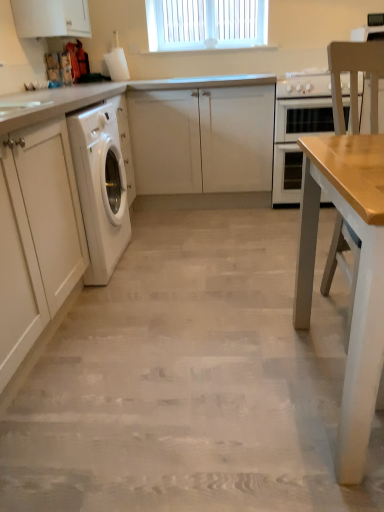
The image size is (384, 512). What are the coordinates of `white matte cabinet at center, the 3th cabinetry in the front-to-back sequence` in the screenshot? It's located at (202, 139).

This screenshot has width=384, height=512. I want to click on white matte cabinet at left, marked as the 1th cabinetry in a front-to-back arrangement, so click(36, 237).

Measure the distance between point (328, 100) and camera.

2.84 meters.

What do you see at coordinates (206, 24) in the screenshot? The height and width of the screenshot is (512, 384). I see `white plastic window at upper center` at bounding box center [206, 24].

The width and height of the screenshot is (384, 512). What do you see at coordinates (355, 79) in the screenshot?
I see `light wood chair at right` at bounding box center [355, 79].

This screenshot has width=384, height=512. What do you see at coordinates (191, 380) in the screenshot? I see `light beige wood floor at center` at bounding box center [191, 380].

You are a GUI agent. You are given a task and a screenshot of the screen. Output one action in this format:
    pyautogui.click(x=<x>, y=<y>)
    Task: Click on the white matte cabinet at upper left, placed as the 2th cabinetry when sorted from back to front
    This screenshot has height=512, width=384.
    Given the screenshot: What is the action you would take?
    pyautogui.click(x=51, y=18)

Is point (62, 25) in front of point (284, 105)?

Yes, it is in front of point (284, 105).

In the scene shown: Does white matte cabinet at upper left, which is the third cabinetry in bottom-to-top order, have a greater height compared to white glossy oven at center?

In fact, white matte cabinet at upper left, which is the third cabinetry in bottom-to-top order, may be shorter than white glossy oven at center.

Is the depth of white matte cabinet at upper left, acting as the first cabinetry starting from the top, greater than that of white glossy oven at center?

No, white matte cabinet at upper left, acting as the first cabinetry starting from the top, is closer to the viewer.

Can you confirm if white glossy stove at upper right is smaller than white matte cabinet at upper left, placed as the 2th cabinetry when sorted from back to front?

No, white glossy stove at upper right is not smaller than white matte cabinet at upper left, placed as the 2th cabinetry when sorted from back to front.

How many degrees apart are the facing directions of white glossy stove at upper right and white matte cabinet at upper left, placed as the 2th cabinetry when sorted from back to front?

90.5 degrees separate the facing orientations of white glossy stove at upper right and white matte cabinet at upper left, placed as the 2th cabinetry when sorted from back to front.

Considering the relative sizes of white glossy stove at upper right and white matte cabinet at upper left, placed as the 2th cabinetry when sorted from back to front, in the image provided, is white glossy stove at upper right wider than white matte cabinet at upper left, placed as the 2th cabinetry when sorted from back to front,?

Yes.

From a real-world perspective, which is physically above, white glossy stove at upper right or white matte cabinet at upper left, acting as the first cabinetry starting from the top?

In real-world perspective, white matte cabinet at upper left, acting as the first cabinetry starting from the top, is above.

From a real-world perspective, which is physically below, white matte cabinet at upper left, acting as the first cabinetry starting from the top, or light wood chair at right?

light wood chair at right.

Can you see white matte cabinet at upper left, acting as the first cabinetry starting from the top, touching light wood chair at right?

They are not placed beside each other.

Is white matte cabinet at upper left, which is the third cabinetry in bottom-to-top order, closer to camera compared to light wood chair at right?

No, white matte cabinet at upper left, which is the third cabinetry in bottom-to-top order, is further to the viewer.

Based on the photo, looking at the image, does white matte cabinet at upper left, which is the third cabinetry in bottom-to-top order, seem bigger or smaller compared to light wood chair at right?

Considering their sizes, white matte cabinet at upper left, which is the third cabinetry in bottom-to-top order, takes up less space than light wood chair at right.

Which object is positioned more to the left, white plastic window at upper center or white matte cabinet at center, the 3th cabinetry in the front-to-back sequence?

From the viewer's perspective, white matte cabinet at center, the 3th cabinetry in the front-to-back sequence, appears more on the left side.

Which is further, (x=247, y=16) or (x=178, y=172)?

The point (x=247, y=16) is more distant.

Who is bigger, white plastic window at upper center or white matte cabinet at center, placed as the 2th cabinetry when sorted from bottom to top?

Bigger between the two is white matte cabinet at center, placed as the 2th cabinetry when sorted from bottom to top.

From a real-world perspective, is white matte cabinet at left, which is counted as the third cabinetry, starting from the top, located higher than light beige wood floor at center?

Yes.

Is white matte cabinet at left, which is counted as the third cabinetry, starting from the top, oriented towards light beige wood floor at center?

Yes, white matte cabinet at left, which is counted as the third cabinetry, starting from the top, is aimed at light beige wood floor at center.

Is white matte cabinet at left, acting as the third cabinetry starting from the back, situated inside light beige wood floor at center or outside?

white matte cabinet at left, acting as the third cabinetry starting from the back, is not enclosed by light beige wood floor at center.

Consider the image. Is white matte cabinet at left, which is the 1th cabinetry from bottom to top, bigger than light beige wood floor at center?

Correct, white matte cabinet at left, which is the 1th cabinetry from bottom to top, is larger in size than light beige wood floor at center.

Is light beige wood floor at center at the back of white glossy oven at center?

That's not correct — white glossy oven at center is not looking away from light beige wood floor at center.

Considering the positions of objects white glossy oven at center and light beige wood floor at center in the image provided, who is in front, white glossy oven at center or light beige wood floor at center?

light beige wood floor at center is more forward.

Which of these two, white glossy oven at center or light beige wood floor at center, is smaller?

With smaller size is light beige wood floor at center.

Is white matte cabinet at left, which is the 1th cabinetry from bottom to top, in front of or behind white glossy oven at center in the image?

Visually, white matte cabinet at left, which is the 1th cabinetry from bottom to top, is located in front of white glossy oven at center.

In the scene shown: Is white matte cabinet at left, marked as the 1th cabinetry in a front-to-back arrangement, positioned beyond the bounds of white glossy oven at center?

Yes, white matte cabinet at left, marked as the 1th cabinetry in a front-to-back arrangement, is located beyond the bounds of white glossy oven at center.

From the image's perspective, is white matte cabinet at left, marked as the 1th cabinetry in a front-to-back arrangement, above or below white glossy oven at center?

white matte cabinet at left, marked as the 1th cabinetry in a front-to-back arrangement, is below white glossy oven at center.

How many degrees apart are the facing directions of white matte cabinet at left, which is counted as the third cabinetry, starting from the top, and white glossy oven at center?

90.5 degrees separate the facing orientations of white matte cabinet at left, which is counted as the third cabinetry, starting from the top, and white glossy oven at center.

At what (x,y) coordinates should I click in order to perform the action: click on cabinetry that is the 2nd object located above the white glossy oven at center (from the image's perspective). Please return your answer as a coordinate pair (x, y). This screenshot has height=512, width=384. Looking at the image, I should click on (51, 18).

This screenshot has height=512, width=384. I want to click on stove below the white matte cabinet at upper left, acting as the first cabinetry starting from the top (from the image's perspective), so click(304, 84).

Looking at the image, which one is located further to light beige wood floor at center, white plastic window at upper center or white matte cabinet at upper left, acting as the first cabinetry starting from the top?

Among the two, white plastic window at upper center is located further to light beige wood floor at center.

Which object lies nearer to the anchor point white matte cabinet at upper left, marked as the second cabinetry in a front-to-back arrangement, white glossy oven at center or white matte cabinet at center, positioned as the second cabinetry in top-to-bottom order?

white matte cabinet at center, positioned as the second cabinetry in top-to-bottom order, is positioned closer to the anchor white matte cabinet at upper left, marked as the second cabinetry in a front-to-back arrangement.

From the image, which object appears to be farther from white glossy oven at center, light beige wood floor at center or white matte cabinet at left, which is counted as the third cabinetry, starting from the top?

white matte cabinet at left, which is counted as the third cabinetry, starting from the top, lies further to white glossy oven at center than the other object.

Which object lies nearer to the anchor point white plastic window at upper center, white glossy stove at upper right or white glossy oven at center?

white glossy stove at upper right is positioned closer to the anchor white plastic window at upper center.

When comparing their distances from white plastic window at upper center, does white glossy oven at center or white matte cabinet at center, positioned as the second cabinetry in top-to-bottom order, seem further?

white matte cabinet at center, positioned as the second cabinetry in top-to-bottom order, is positioned further to the anchor white plastic window at upper center.

When comparing their distances from light wood chair at right, does white plastic window at upper center or white glossy stove at upper right seem further?

white plastic window at upper center lies further to light wood chair at right than the other object.

Looking at the image, which one is located closer to white glossy stove at upper right, white glossy oven at center or white matte cabinet at upper left, which is the third cabinetry in bottom-to-top order?

white glossy oven at center is closer to white glossy stove at upper right.

From the image, which object appears to be farther from light beige wood floor at center, light wood chair at right or white matte cabinet at left, marked as the 1th cabinetry in a front-to-back arrangement?

light wood chair at right is positioned further to the anchor light beige wood floor at center.

The height and width of the screenshot is (512, 384). In order to click on stove between white matte cabinet at left, which is counted as the third cabinetry, starting from the top, and white glossy oven at center from front to back in this screenshot , I will do `click(304, 84)`.

The height and width of the screenshot is (512, 384). In order to click on stove positioned between light wood chair at right and white glossy oven at center from near to far in this screenshot , I will do `click(304, 84)`.

You are a GUI agent. You are given a task and a screenshot of the screen. Output one action in this format:
    pyautogui.click(x=<x>, y=<y>)
    Task: Click on the chair that lies between white matte cabinet at upper left, marked as the second cabinetry in a front-to-back arrangement, and light beige wood floor at center from top to bottom
    The height and width of the screenshot is (512, 384).
    Given the screenshot: What is the action you would take?
    pyautogui.click(x=355, y=79)

At what (x,y) coordinates should I click in order to perform the action: click on cabinetry positioned between white matte cabinet at left, marked as the 1th cabinetry in a front-to-back arrangement, and white glossy stove at upper right from near to far. Please return your answer as a coordinate pair (x, y). Looking at the image, I should click on (51, 18).